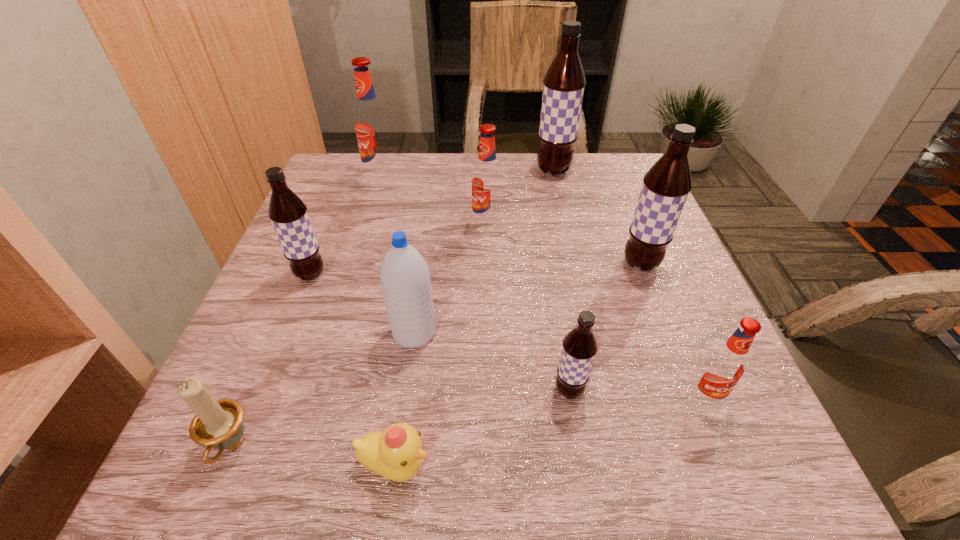
The height and width of the screenshot is (540, 960). Find the location of `blue water bottle`. blue water bottle is located at coordinates (405, 279).

Locate an element on the screen. the nearest brown root beer is located at coordinates (579, 348).

Find the location of `the smallest red root beer`. the smallest red root beer is located at coordinates (725, 365).

At what (x,y) coordinates should I click in order to perform the action: click on the nearest red root beer. Please return your answer as a coordinate pair (x, y). Looking at the image, I should click on (725, 365).

Find the location of a particular element. candle_holder is located at coordinates (217, 424).

Find the location of a particular element. duckling is located at coordinates (396, 453).

Locate an element on the screen. Image resolution: width=960 pixels, height=540 pixels. yellow duckling is located at coordinates (396, 453).

Locate an element on the screen. This screenshot has height=540, width=960. vacant space located 0.130m on the right of the tallest object is located at coordinates [x=620, y=171].

Identify the location of blank space located on the right of the leftmost red root beer. (537, 178).

Locate an element on the screen. The width and height of the screenshot is (960, 540). vacant space located 0.230m on the front of the rightmost brown root beer is located at coordinates (684, 375).